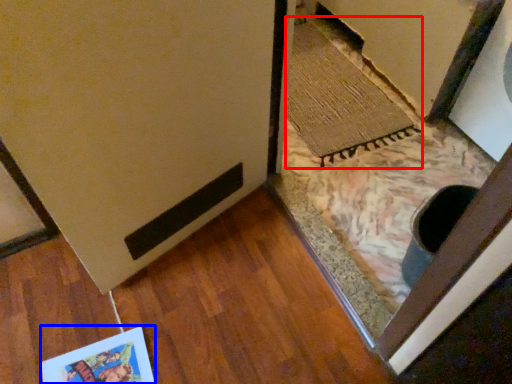
Question: Which of the following is the closest to the observer, doormat (highlighted by a red box) or postcard (highlighted by a blue box)?

Choices:
 (A) doormat
 (B) postcard

Answer: (B)